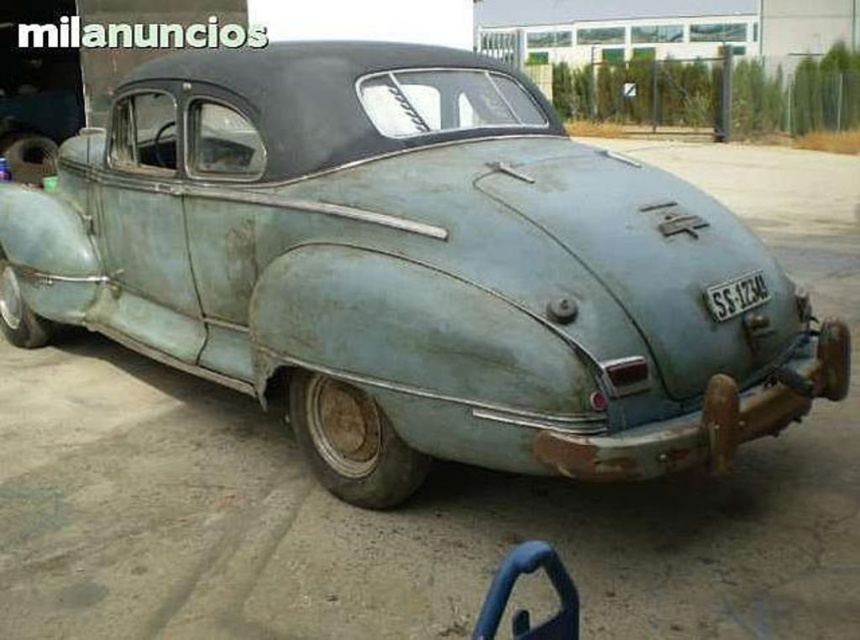
Question: Does rusty metallic car at center have a greater width compared to metallic gray license plate at center?

Choices:
 (A) yes
 (B) no

Answer: (A)

Question: Which point is farther to the camera?

Choices:
 (A) (717, 300)
 (B) (566, 310)

Answer: (A)

Question: Among these points, which one is nearest to the camera?

Choices:
 (A) (723, 282)
 (B) (366, 228)

Answer: (A)

Question: Is rusty metallic car at center in front of metallic gray license plate at center?

Choices:
 (A) no
 (B) yes

Answer: (B)

Question: Is rusty metallic car at center bigger than metallic gray license plate at center?

Choices:
 (A) no
 (B) yes

Answer: (B)